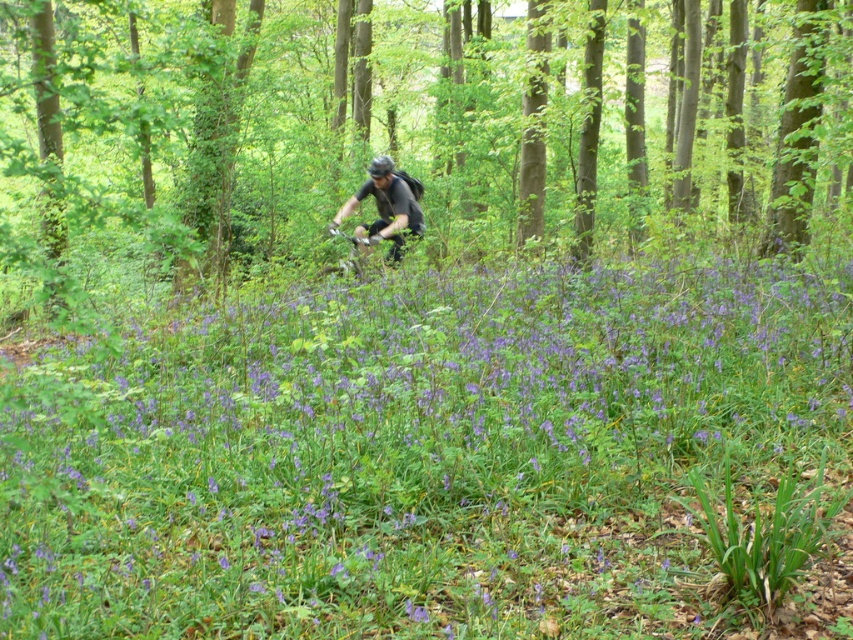
You are a hiker in the forest and want to know if the purple matte flowers at center are shorter than the shiny black helmet at center. Can you tell me?

The purple matte flowers at center has a lesser height compared to shiny black helmet at center, so yes, the purple matte flowers at center are shorter than the shiny black helmet at center.

You are a photographer trying to capture a clear photo of the shiny black helmet at center. However, the green leafy tree at center is blocking your view. Can you estimate whether the tree is wider than the helmet?

The green leafy tree at center is wider than the shiny black helmet at center, so the tree is blocking the view of the helmet.